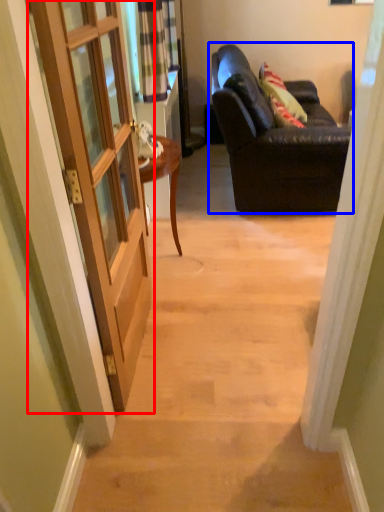
Question: Among these objects, which one is farthest to the camera, door (highlighted by a red box) or studio couch (highlighted by a blue box)?

Choices:
 (A) door
 (B) studio couch

Answer: (B)